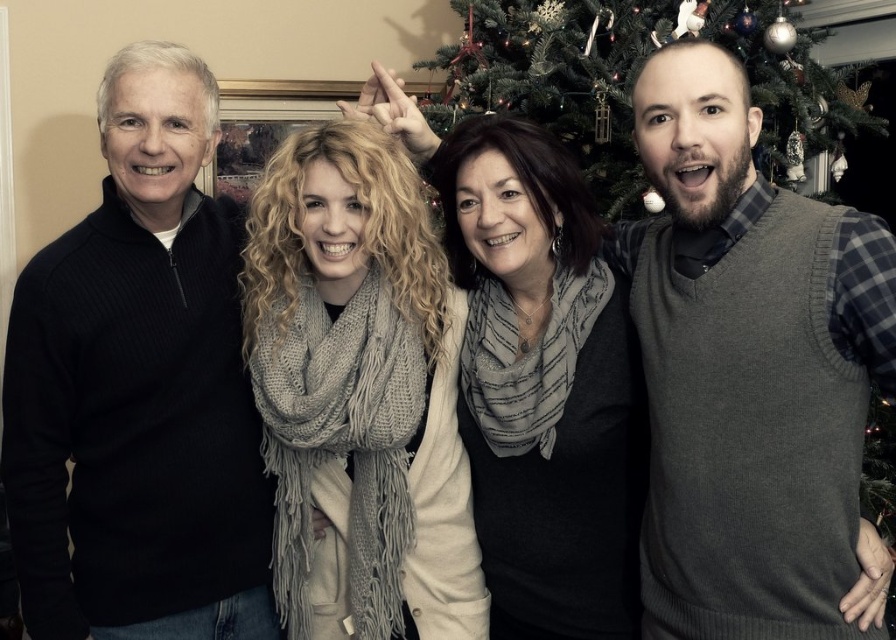
You are standing in front of the Christmas tree and want to place a gift box at the same 2D location as the knitted scarf at center. What are the coordinates where you should place the gift box?

The coordinates for the knitted scarf at center are at point (359, 392), so you should place the gift box at those coordinates.

You are standing in the room where the group is posing. You notice two points marked in the image. Which point, point [485,602] or point [471,208], is closer to you?

Point [485,602] is closer to you because it is further to the viewer than point [471,208].

You are a photographer trying to capture a closeup of the gray knitted vest at right and the gray scarf at center. Which one is positioned higher in the image?

The gray knitted vest at right is positioned higher than the gray scarf at center in the image.